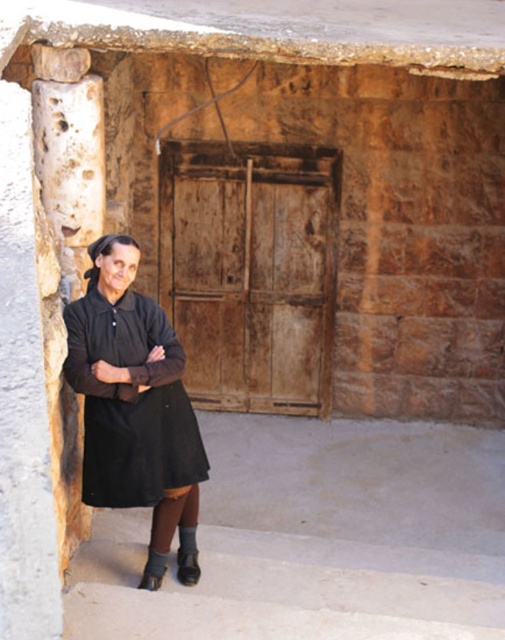
Between rusty wood door at center and black suede boot at lower left, which one has less height?

With less height is black suede boot at lower left.

Is point (230, 163) positioned in front of point (164, 561)?

No.

I want to click on rusty wood door at center, so click(250, 272).

Which of these two, rusty wood door at center or matte black dress at center, stands taller?

Standing taller between the two is rusty wood door at center.

Who is more distant from viewer, (256, 163) or (131, 307)?

The point (256, 163) is more distant.

Which is behind, point (295, 362) or point (186, 490)?

The point (295, 362) is more distant.

Where is `rusty wood door at center`? This screenshot has width=505, height=640. rusty wood door at center is located at coordinates (250, 272).

Does point (162, 496) come behind point (162, 557)?

No.

Can you confirm if matte black dress at center is thinner than black suede boot at lower left?

In fact, matte black dress at center might be wider than black suede boot at lower left.

Based on the photo, measure the distance between point (156, 516) and camera.

Point (156, 516) and camera are 4.73 meters apart from each other.

In order to click on matte black dress at center in this screenshot , I will do `click(131, 396)`.